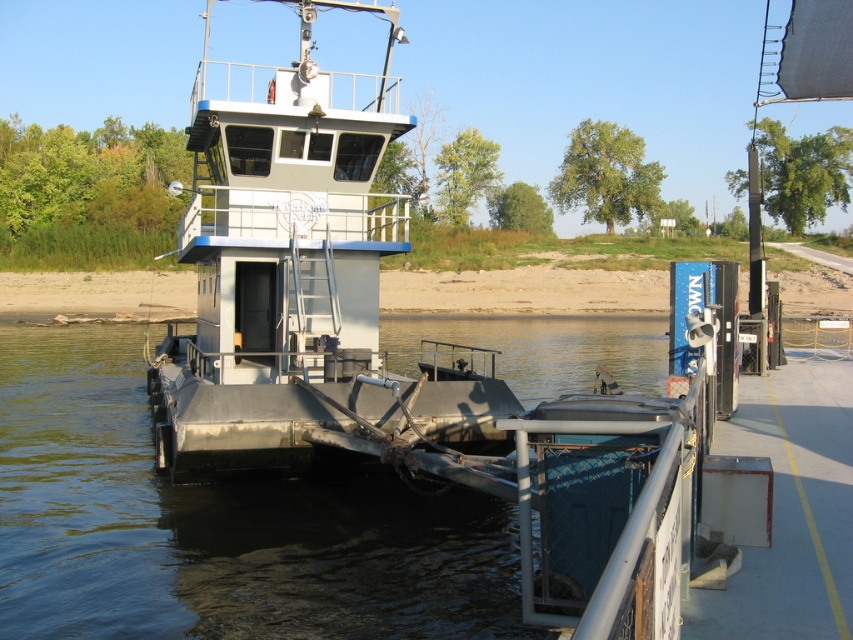
Question: Can you confirm if metallic water at center is positioned below metallic gray boat at center?

Choices:
 (A) yes
 (B) no

Answer: (A)

Question: Can you confirm if metallic water at center is wider than metallic gray boat at center?

Choices:
 (A) no
 (B) yes

Answer: (A)

Question: Which of the following is the farthest from the observer?

Choices:
 (A) metallic gray boat at center
 (B) metallic water at center

Answer: (B)

Question: Among these points, which one is nearest to the camera?

Choices:
 (A) (294, 544)
 (B) (170, 452)

Answer: (A)

Question: Is metallic water at center bigger than metallic gray boat at center?

Choices:
 (A) no
 (B) yes

Answer: (A)